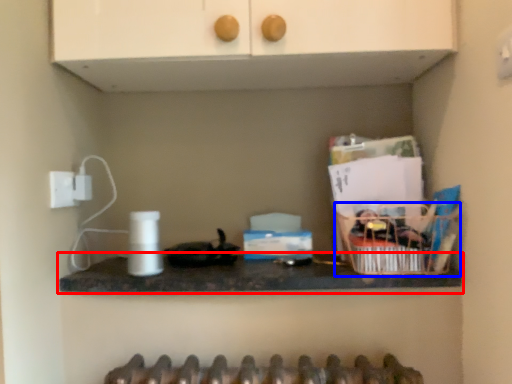
Question: Among these objects, which one is farthest to the camera, countertop (highlighted by a red box) or basket (highlighted by a blue box)?

Choices:
 (A) countertop
 (B) basket

Answer: (B)